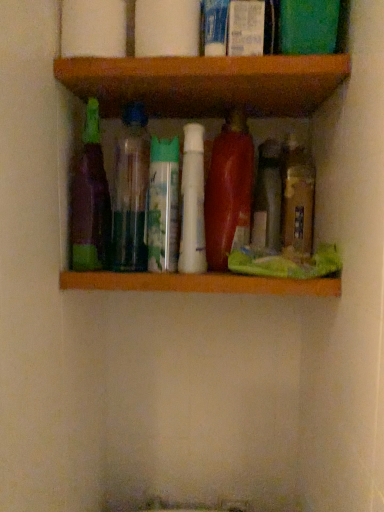
This screenshot has width=384, height=512. Find the location of `white glossy lotion at upper center, the 1th toiletry in the right-to-left sequence`. white glossy lotion at upper center, the 1th toiletry in the right-to-left sequence is located at coordinates (246, 28).

What do you see at coordinates (215, 27) in the screenshot? I see `white plastic tube at upper center, which is the second toiletry in right-to-left order` at bounding box center [215, 27].

How much space does white plastic tube at upper center, which is the second toiletry in right-to-left order, occupy vertically?

white plastic tube at upper center, which is the second toiletry in right-to-left order, is 15.90 centimeters in height.

In order to face purple matte bottle at left, the sixth bottle positioned from the right, should I rotate leftwards or rightwards?

Turn left by 13.334 degrees to look at purple matte bottle at left, the sixth bottle positioned from the right.

Identify the location of translucent plastic bottle at center, which is the 5th bottle from left to right. The width and height of the screenshot is (384, 512). (267, 199).

Measure the distance between point (153, 159) and camera.

Point (153, 159) and camera are 28.43 inches apart.

What is the approximate width of green matte spray can at center?

The width of green matte spray can at center is 4.24 inches.

What do you see at coordinates (93, 28) in the screenshot? This screenshot has height=512, width=384. I see `white matte toilet paper at upper center, which is the first toilet paper from left to right` at bounding box center [93, 28].

In order to click on translucent plastic bottle at center, marked as the 1th bottle in a right-to-left arrangement in this screenshot , I will do `click(297, 199)`.

The height and width of the screenshot is (512, 384). In order to click on white glossy lotion at upper center, the 1th toiletry in the right-to-left sequence in this screenshot , I will do `click(246, 28)`.

Does shiny red plastic bottle at center, which is counted as the fourth bottle, starting from the left, come behind white matte tube at center, arranged as the third bottle when viewed from the left?

Yes, the depth of shiny red plastic bottle at center, which is counted as the fourth bottle, starting from the left, is greater than that of white matte tube at center, arranged as the third bottle when viewed from the left.

Is shiny red plastic bottle at center, the third bottle from the right, touching white matte tube at center, arranged as the third bottle when viewed from the left?

Absolutely, shiny red plastic bottle at center, the third bottle from the right, is next to and touching white matte tube at center, arranged as the third bottle when viewed from the left.

From a real-world perspective, is shiny red plastic bottle at center, which is counted as the fourth bottle, starting from the left, positioned over white matte tube at center, marked as the fourth bottle in a right-to-left arrangement, based on gravity?

Correct, in the physical world, shiny red plastic bottle at center, which is counted as the fourth bottle, starting from the left, is higher than white matte tube at center, marked as the fourth bottle in a right-to-left arrangement.

In the image, is shiny red plastic bottle at center, the third bottle from the right, on the left side or the right side of white matte tube at center, arranged as the third bottle when viewed from the left?

From the image, it's evident that shiny red plastic bottle at center, the third bottle from the right, is to the right of white matte tube at center, arranged as the third bottle when viewed from the left.

Between translucent plastic bottles at center, the 5th bottle positioned from the right, and shiny red plastic bottle at center, the third bottle from the right, which one has more height?

translucent plastic bottles at center, the 5th bottle positioned from the right, is taller.

Where is `bottle that is the 1st object located below the translucent plastic bottles at center, the 5th bottle positioned from the right (from the image's perspective)`? Image resolution: width=384 pixels, height=512 pixels. bottle that is the 1st object located below the translucent plastic bottles at center, the 5th bottle positioned from the right (from the image's perspective) is located at coordinates (229, 191).

Between translucent plastic bottles at center, the 2th bottle when ordered from left to right, and shiny red plastic bottle at center, the third bottle from the right, which one appears on the left side from the viewer's perspective?

translucent plastic bottles at center, the 2th bottle when ordered from left to right.

Is white plastic tube at upper center, which appears as the 1th toiletry when viewed from the left, not inside translucent plastic bottle at center, marked as the 1th bottle in a right-to-left arrangement?

Yes, white plastic tube at upper center, which appears as the 1th toiletry when viewed from the left, is located beyond the bounds of translucent plastic bottle at center, marked as the 1th bottle in a right-to-left arrangement.

From a real-world perspective, is white plastic tube at upper center, which appears as the 1th toiletry when viewed from the left, physically below translucent plastic bottle at center, marked as the 1th bottle in a right-to-left arrangement?

Actually, white plastic tube at upper center, which appears as the 1th toiletry when viewed from the left, is physically above translucent plastic bottle at center, marked as the 1th bottle in a right-to-left arrangement, in the real world.

Is white plastic tube at upper center, which appears as the 1th toiletry when viewed from the left, facing towards translucent plastic bottle at center, which appears as the 6th bottle when viewed from the left?

No, white plastic tube at upper center, which appears as the 1th toiletry when viewed from the left, does not turn towards translucent plastic bottle at center, which appears as the 6th bottle when viewed from the left.

Is white plastic tube at upper center, which is the second toiletry in right-to-left order, positioned before translucent plastic bottle at center, marked as the 1th bottle in a right-to-left arrangement?

Yes, white plastic tube at upper center, which is the second toiletry in right-to-left order, is in front of translucent plastic bottle at center, marked as the 1th bottle in a right-to-left arrangement.

Which of these two, white matte toilet paper at upper center, positioned as the second toilet paper in left-to-right order, or white glossy lotion at upper center, which appears as the second toiletry when viewed from the left, is wider?

With larger width is white matte toilet paper at upper center, positioned as the second toilet paper in left-to-right order.

Is white matte toilet paper at upper center, positioned as the second toilet paper in left-to-right order, not near white glossy lotion at upper center, which appears as the second toiletry when viewed from the left?

No, there isn't a large distance between white matte toilet paper at upper center, positioned as the second toilet paper in left-to-right order, and white glossy lotion at upper center, which appears as the second toiletry when viewed from the left.

Can we say white matte toilet paper at upper center, placed as the 1th toilet paper when sorted from right to left, lies outside white glossy lotion at upper center, which appears as the second toiletry when viewed from the left?

Yes, white matte toilet paper at upper center, placed as the 1th toilet paper when sorted from right to left, is not within white glossy lotion at upper center, which appears as the second toiletry when viewed from the left.

Does white matte toilet paper at upper center, positioned as the second toilet paper in left-to-right order, turn towards white glossy lotion at upper center, which appears as the second toiletry when viewed from the left?

No, white matte toilet paper at upper center, positioned as the second toilet paper in left-to-right order, does not turn towards white glossy lotion at upper center, which appears as the second toiletry when viewed from the left.

In terms of size, does white matte tube at center, marked as the fourth bottle in a right-to-left arrangement, appear bigger or smaller than green matte spray can at center?

Considering their sizes, white matte tube at center, marked as the fourth bottle in a right-to-left arrangement, takes up less space than green matte spray can at center.

Where is `cleaning product below the white matte tube at center, marked as the fourth bottle in a right-to-left arrangement (from the image's perspective)`? cleaning product below the white matte tube at center, marked as the fourth bottle in a right-to-left arrangement (from the image's perspective) is located at coordinates (163, 205).

From their relative heights in the image, would you say white matte tube at center, marked as the fourth bottle in a right-to-left arrangement, is taller or shorter than green matte spray can at center?

white matte tube at center, marked as the fourth bottle in a right-to-left arrangement, is taller than green matte spray can at center.

Is wooden shelf at upper center positioned with its back to translucent plastic bottle at center, which appears as the 6th bottle when viewed from the left?

That's not correct — wooden shelf at upper center is not looking away from translucent plastic bottle at center, which appears as the 6th bottle when viewed from the left.

Is point (285, 75) less distant than point (287, 217)?

Yes, point (285, 75) is in front of point (287, 217).

Which of these two, wooden shelf at upper center or translucent plastic bottle at center, marked as the 1th bottle in a right-to-left arrangement, is wider?

With larger width is wooden shelf at upper center.

Which object is further away from the camera taking this photo, wooden shelf at upper center or translucent plastic bottle at center, marked as the 1th bottle in a right-to-left arrangement?

Positioned behind is translucent plastic bottle at center, marked as the 1th bottle in a right-to-left arrangement.

Considering the positions of objects translucent plastic bottle at center, which is the 5th bottle from left to right, and white glossy lotion at upper center, the 1th toiletry in the right-to-left sequence, in the image provided, who is in front, translucent plastic bottle at center, which is the 5th bottle from left to right, or white glossy lotion at upper center, the 1th toiletry in the right-to-left sequence,?

white glossy lotion at upper center, the 1th toiletry in the right-to-left sequence, is in front.

Is translucent plastic bottle at center, which appears as the second bottle when viewed from the right, to the left or to the right of white glossy lotion at upper center, which appears as the second toiletry when viewed from the left, in the image?

Based on their positions, translucent plastic bottle at center, which appears as the second bottle when viewed from the right, is located to the right of white glossy lotion at upper center, which appears as the second toiletry when viewed from the left.

Looking at this image, can you confirm if translucent plastic bottle at center, which is the 5th bottle from left to right, is thinner than white glossy lotion at upper center, the 1th toiletry in the right-to-left sequence?

Incorrect, the width of translucent plastic bottle at center, which is the 5th bottle from left to right, is not less than that of white glossy lotion at upper center, the 1th toiletry in the right-to-left sequence.

How many degrees apart are the facing directions of translucent plastic bottle at center, which is the 5th bottle from left to right, and white glossy lotion at upper center, the 1th toiletry in the right-to-left sequence?

The facing directions of translucent plastic bottle at center, which is the 5th bottle from left to right, and white glossy lotion at upper center, the 1th toiletry in the right-to-left sequence, are 0.954 degrees apart.

This screenshot has width=384, height=512. In order to click on the 1st bottle to the left when counting from the shiny red plastic bottle at center, the third bottle from the right in this screenshot , I will do `click(192, 203)`.

From a real-world perspective, count 2nd bottles upward from the shiny red plastic bottle at center, which is counted as the fourth bottle, starting from the left, and point to it. Please provide its 2D coordinates.

[(130, 192)]

Which object lies nearer to the anchor point translucent plastic bottle at center, which appears as the second bottle when viewed from the right, white matte toilet paper at upper center, positioned as the second toilet paper in left-to-right order, or shiny red plastic bottle at center, which is counted as the fourth bottle, starting from the left?

Based on the image, shiny red plastic bottle at center, which is counted as the fourth bottle, starting from the left, appears to be nearer to translucent plastic bottle at center, which appears as the second bottle when viewed from the right.

From the image, which object appears to be farther from green matte spray can at center, white matte toilet paper at upper center, positioned as the second toilet paper in left-to-right order, or wooden shelf at upper center?

white matte toilet paper at upper center, positioned as the second toilet paper in left-to-right order, is further to green matte spray can at center.

Based on their spatial positions, is translucent plastic bottle at center, which is the 5th bottle from left to right, or purple matte bottle at left, which is the first bottle from left to right, closer to white matte toilet paper at upper center, which is the 2th toilet paper in right-to-left order?

purple matte bottle at left, which is the first bottle from left to right, lies closer to white matte toilet paper at upper center, which is the 2th toilet paper in right-to-left order, than the other object.

From the image, which object appears to be nearer to white glossy lotion at upper center, which appears as the second toiletry when viewed from the left, shiny red plastic bottle at center, the third bottle from the right, or green matte spray can at center?

shiny red plastic bottle at center, the third bottle from the right, is closer to white glossy lotion at upper center, which appears as the second toiletry when viewed from the left.

Estimate the real-world distances between objects in this image. Which object is closer to white matte toilet paper at upper center, which is the 2th toilet paper in right-to-left order, white matte tube at center, marked as the fourth bottle in a right-to-left arrangement, or translucent plastic bottles at center, the 2th bottle when ordered from left to right?

white matte tube at center, marked as the fourth bottle in a right-to-left arrangement, is positioned closer to the anchor white matte toilet paper at upper center, which is the 2th toilet paper in right-to-left order.

Which object lies nearer to the anchor point translucent plastic bottles at center, the 2th bottle when ordered from left to right, translucent plastic bottle at center, marked as the 1th bottle in a right-to-left arrangement, or white glossy lotion at upper center, the 1th toiletry in the right-to-left sequence?

translucent plastic bottle at center, marked as the 1th bottle in a right-to-left arrangement, lies closer to translucent plastic bottles at center, the 2th bottle when ordered from left to right, than the other object.

Based on their spatial positions, is white matte tube at center, marked as the fourth bottle in a right-to-left arrangement, or white plastic tube at upper center, which appears as the 1th toiletry when viewed from the left, closer to shiny red plastic bottle at center, which is counted as the fourth bottle, starting from the left?

Based on the image, white matte tube at center, marked as the fourth bottle in a right-to-left arrangement, appears to be nearer to shiny red plastic bottle at center, which is counted as the fourth bottle, starting from the left.

Estimate the real-world distances between objects in this image. Which object is closer to white plastic tube at upper center, which is the second toiletry in right-to-left order, translucent plastic bottles at center, the 5th bottle positioned from the right, or white matte tube at center, arranged as the third bottle when viewed from the left?

Based on the image, white matte tube at center, arranged as the third bottle when viewed from the left, appears to be nearer to white plastic tube at upper center, which is the second toiletry in right-to-left order.

Locate an element on the screen. Image resolution: width=384 pixels, height=512 pixels. bottle between translucent plastic bottles at center, the 2th bottle when ordered from left to right, and shiny red plastic bottle at center, the third bottle from the right, in the horizontal direction is located at coordinates coord(192,203).

Identify the location of shelf between white matte toilet paper at upper center, which is the 2th toilet paper in right-to-left order, and green matte spray can at center, in the vertical direction. (206, 84).

You are a GUI agent. You are given a task and a screenshot of the screen. Output one action in this format:
    pyautogui.click(x=<x>, y=<y>)
    Task: Click on the toilet paper located between translucent plastic bottles at center, the 5th bottle positioned from the right, and translucent plastic bottle at center, marked as the 1th bottle in a right-to-left arrangement, in the left-right direction
    The width and height of the screenshot is (384, 512).
    Given the screenshot: What is the action you would take?
    pyautogui.click(x=167, y=28)

Identify the location of toilet paper between white matte toilet paper at upper center, which is the first toilet paper from left to right, and translucent plastic bottles at center, the 2th bottle when ordered from left to right, vertically. (167, 28).